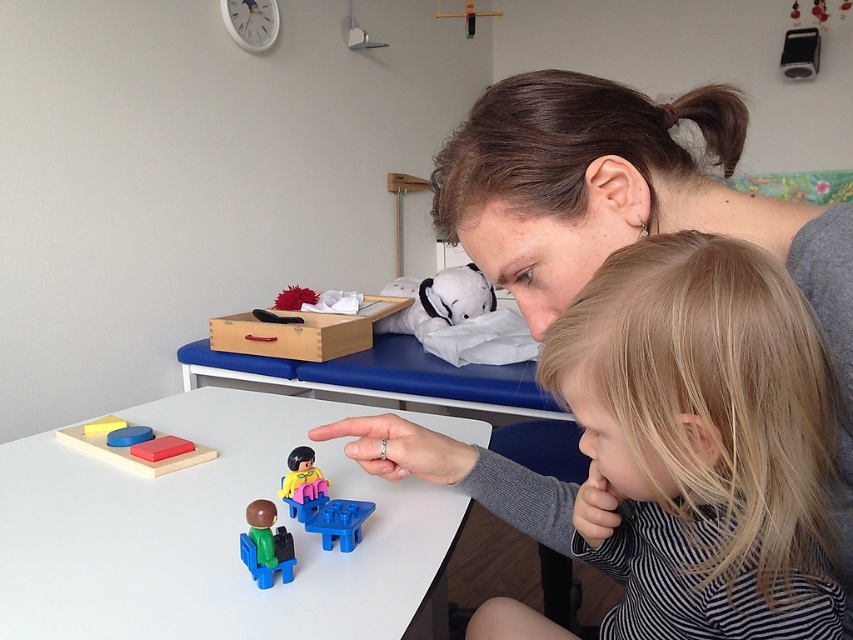
Question: Which point is closer to the camera?

Choices:
 (A) (248, 547)
 (B) (123, 440)
 (C) (718, 481)

Answer: (C)

Question: Does rubberized yellow toy at center appear under yellow matte block at upper left?

Choices:
 (A) no
 (B) yes

Answer: (B)

Question: Is blonde hair at upper right further to camera compared to yellow matte block at upper left?

Choices:
 (A) yes
 (B) no

Answer: (B)

Question: Which of the following is the closest to the observer?

Choices:
 (A) rubberized yellow toy at center
 (B) white plastic table at center
 (C) rubber matte block at table

Answer: (B)

Question: Is blonde hair at upper right further to camera compared to yellow matte block at upper left?

Choices:
 (A) yes
 (B) no

Answer: (B)

Question: Among these objects, which one is nearest to the camera?

Choices:
 (A) blue plastic table at center
 (B) green plastic toy at center
 (C) smooth plastic blocks at center
 (D) white plastic table at center

Answer: (D)